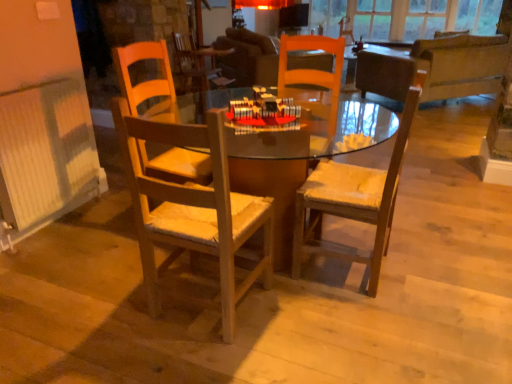
The height and width of the screenshot is (384, 512). In order to click on white ribbed radiator at left in this screenshot , I will do `click(45, 151)`.

This screenshot has height=384, width=512. What do you see at coordinates (436, 68) in the screenshot?
I see `dark brown leather couch at upper right` at bounding box center [436, 68].

The width and height of the screenshot is (512, 384). In order to click on wooden chair at center, which ranks as the second chair in right-to-left order in this screenshot , I will do `click(193, 208)`.

Image resolution: width=512 pixels, height=384 pixels. In order to click on wooden table at center in this screenshot , I will do `click(193, 209)`.

This screenshot has width=512, height=384. What do you see at coordinates (193, 209) in the screenshot?
I see `wooden table at center` at bounding box center [193, 209].

Identify the location of white ribbed radiator at left. (45, 151).

Are wooden chair at center, which ranks as the second chair in right-to-left order, and wooden chair with cushion at center, which is counted as the second chair, starting from the left, making contact?

wooden chair at center, which ranks as the second chair in right-to-left order, is not next to wooden chair with cushion at center, which is counted as the second chair, starting from the left, and they're not touching.

Image resolution: width=512 pixels, height=384 pixels. Find the location of `chair on the left of wooden chair with cushion at center, which is the first chair from right to left`. chair on the left of wooden chair with cushion at center, which is the first chair from right to left is located at coordinates (193, 208).

Consider the image. Which is correct: wooden chair at center, which ranks as the second chair in right-to-left order, is inside wooden chair with cushion at center, which is the first chair from right to left, or outside of it?

wooden chair at center, which ranks as the second chair in right-to-left order, is spatially situated outside wooden chair with cushion at center, which is the first chair from right to left.

Does point (222, 266) come behind point (307, 183)?

No, (222, 266) is in front of (307, 183).

From the image's perspective, which is above, wooden chair with cushion at center, which is counted as the second chair, starting from the left, or transparent glass window at upper center?

transparent glass window at upper center is shown above in the image.

Can you confirm if wooden chair with cushion at center, which is counted as the second chair, starting from the left, is thinner than transparent glass window at upper center?

Incorrect, the width of wooden chair with cushion at center, which is counted as the second chair, starting from the left, is not less than that of transparent glass window at upper center.

Can you tell me how much wooden chair with cushion at center, which is counted as the second chair, starting from the left, and transparent glass window at upper center differ in facing direction?

The facing directions of wooden chair with cushion at center, which is counted as the second chair, starting from the left, and transparent glass window at upper center are 87.2 degrees apart.

From the image's perspective, which is below, wooden chair at center, the 1th chair viewed from the left, or dark brown leather couch at upper right?

wooden chair at center, the 1th chair viewed from the left, from the image's perspective.

Does wooden chair at center, the 1th chair viewed from the left, turn towards dark brown leather couch at upper right?

Yes, wooden chair at center, the 1th chair viewed from the left, faces towards dark brown leather couch at upper right.

Which object is wider, wooden chair at center, which ranks as the second chair in right-to-left order, or dark brown leather couch at upper right?

With larger width is dark brown leather couch at upper right.

Consider the image. From a real-world perspective, is wooden chair at center, the 1th chair viewed from the left, above or below dark brown leather couch at upper right?

In terms of real-world spatial position, wooden chair at center, the 1th chair viewed from the left, is above dark brown leather couch at upper right.

Considering the sizes of objects transparent glass window at upper center and wooden chair at center, which ranks as the second chair in right-to-left order, in the image provided, who is shorter, transparent glass window at upper center or wooden chair at center, which ranks as the second chair in right-to-left order,?

transparent glass window at upper center is shorter.

Considering the relative sizes of transparent glass window at upper center and wooden chair at center, which ranks as the second chair in right-to-left order, in the image provided, is transparent glass window at upper center bigger than wooden chair at center, which ranks as the second chair in right-to-left order,?

Indeed, transparent glass window at upper center has a larger size compared to wooden chair at center, which ranks as the second chair in right-to-left order.

Between transparent glass window at upper center and wooden chair at center, which ranks as the second chair in right-to-left order, which one has smaller width?

transparent glass window at upper center.

Is point (396, 36) more distant than point (177, 229)?

Yes.

Is point (361, 21) more distant than point (17, 201)?

Yes, point (361, 21) is behind point (17, 201).

Is transparent glass window at upper center turned away from white ribbed radiator at left?

transparent glass window at upper center does not have its back to white ribbed radiator at left.

Is transparent glass window at upper center not inside white ribbed radiator at left?

Indeed, transparent glass window at upper center is completely outside white ribbed radiator at left.

From the image's perspective, which one is positioned higher, transparent glass window at upper center or white ribbed radiator at left?

From the image's view, transparent glass window at upper center is above.

Which is closer to the camera, (134, 158) or (410, 28)?

Point (134, 158) is closer to the camera than point (410, 28).

From the image's perspective, does wooden table at center appear lower than transparent glass window at upper center?

Yes.

Is wooden table at center oriented away from transparent glass window at upper center?

wooden table at center does not have its back to transparent glass window at upper center.

Is wooden table at center far away from transparent glass window at upper center?

That's right, there is a large distance between wooden table at center and transparent glass window at upper center.

Which of these two, white ribbed radiator at left or wooden table at center, is smaller?

white ribbed radiator at left.

Is white ribbed radiator at left further to the viewer compared to wooden table at center?

Yes, it is.

The width and height of the screenshot is (512, 384). Find the location of `radiator above the wooden table at center (from a real-world perspective)`. radiator above the wooden table at center (from a real-world perspective) is located at coordinates (45, 151).

From the image's perspective, would you say white ribbed radiator at left is shown under wooden table at center?

No, from the image's perspective, white ribbed radiator at left is not beneath wooden table at center.

Image resolution: width=512 pixels, height=384 pixels. Identify the location of chair below the wooden chair with cushion at center, which is counted as the second chair, starting from the left (from the image's perspective). (193, 208).

At what (x,y) coordinates should I click in order to perform the action: click on window above the wooden chair with cushion at center, which is counted as the second chair, starting from the left (from the image's perspective). Please return your answer as a coordinate pair (x, y). This screenshot has width=512, height=384. Looking at the image, I should click on (405, 17).

Estimate the real-world distances between objects in this image. Which object is closer to transparent glass window at upper center, wooden table at center or wooden chair with cushion at center, which is the first chair from right to left?

The object closer to transparent glass window at upper center is wooden chair with cushion at center, which is the first chair from right to left.

Based on their spatial positions, is transparent glass window at upper center or dark brown leather couch at upper right further from wooden chair with cushion at center, which is counted as the second chair, starting from the left?

transparent glass window at upper center.

Estimate the real-world distances between objects in this image. Which object is further from wooden chair at center, the 1th chair viewed from the left, wooden chair with cushion at center, which is the first chair from right to left, or dark brown leather couch at upper right?

Among the two, dark brown leather couch at upper right is located further to wooden chair at center, the 1th chair viewed from the left.

Which object lies further to the anchor point transparent glass window at upper center, wooden chair at center, the 1th chair viewed from the left, or white ribbed radiator at left?

wooden chair at center, the 1th chair viewed from the left, is further to transparent glass window at upper center.

Considering their positions, is dark brown leather couch at upper right positioned further to wooden chair with cushion at center, which is counted as the second chair, starting from the left, than wooden table at center?

dark brown leather couch at upper right is further to wooden chair with cushion at center, which is counted as the second chair, starting from the left.

Based on their spatial positions, is transparent glass window at upper center or white ribbed radiator at left further from dark brown leather couch at upper right?

white ribbed radiator at left.

Which object lies nearer to the anchor point dark brown leather couch at upper right, white ribbed radiator at left or transparent glass window at upper center?

transparent glass window at upper center lies closer to dark brown leather couch at upper right than the other object.

Based on the photo, from the image, which object appears to be farther from transparent glass window at upper center, wooden table at center or white ribbed radiator at left?

The object further to transparent glass window at upper center is white ribbed radiator at left.

What are the coordinates of `studio couch between wooden chair at center, which ranks as the second chair in right-to-left order, and transparent glass window at upper center in the front-back direction` in the screenshot? It's located at (436, 68).

Where is `chair between white ribbed radiator at left and wooden chair with cushion at center, which is the first chair from right to left, in the horizontal direction`? chair between white ribbed radiator at left and wooden chair with cushion at center, which is the first chair from right to left, in the horizontal direction is located at coordinates (193, 208).

Image resolution: width=512 pixels, height=384 pixels. Identify the location of kitchen & dining room table positioned between wooden chair at center, the 1th chair viewed from the left, and dark brown leather couch at upper right from near to far. (193, 209).

Identify the location of radiator between wooden chair with cushion at center, which is the first chair from right to left, and transparent glass window at upper center from front to back. (45, 151).